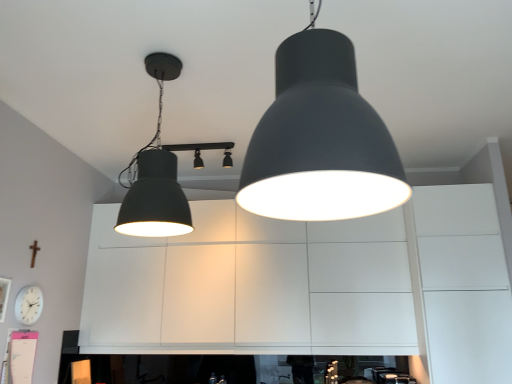
Find the location of a particular element. This screenshot has height=384, width=512. free point above matte black spotlights at center, acting as the 3th lamp starting from the front (from a real-world perspective) is located at coordinates (202, 141).